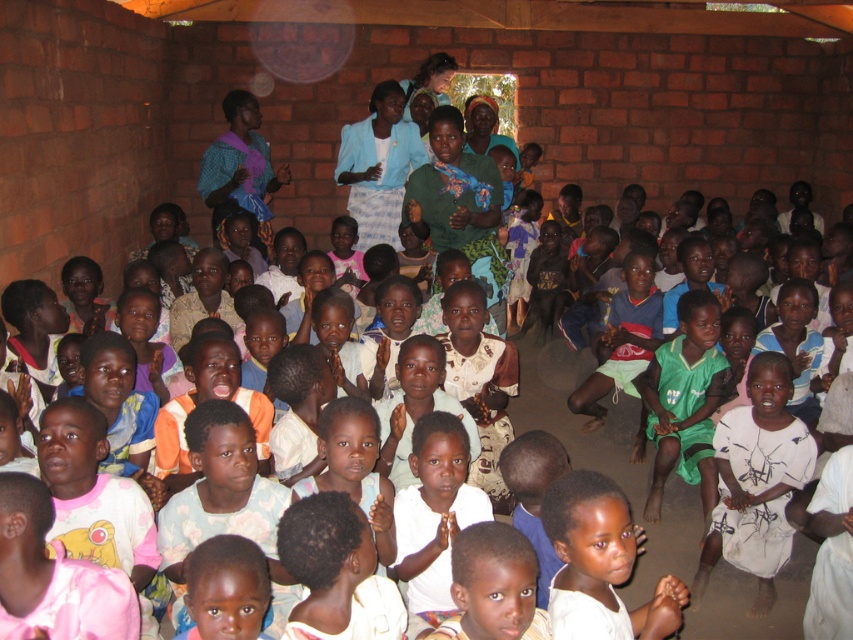
You are a photographer standing in the center of the room. You need to capture a photo that includes both the white printed dress at lower right and the white matte shirt at lower center. What is the minimum distance you need to move backward to ensure both objects are in frame?

The white printed dress at lower right is 1.84 meters from the white matte shirt at lower center. To include both in the frame, you need to move backward at least 1.84 meters to ensure the camera can capture the entire distance between them.

You are standing in the room and want to move from point A to point B. Point A is at coordinate point (773, 554) and point B is at coordinate point (628, 520). Which point is closer to you when you are facing the room from the entrance?

Point B at coordinate point (628, 520) is closer to you because it is further away from the camera compared to point A at coordinate point (773, 554) which is closer to the camera.

You are standing at the point marked as point (x=729, y=525) in the image. A child is standing 4 meters away from you. Can the child see the small window or doorway at the back of the room through which the natural light is coming?

The distance between you and the viewer is 4.19 meters, so the child standing 4 meters away from you would be closer to the window or doorway than you are. Since the window or doorway is partially visible to you, the child would likely have a better view and can see it.